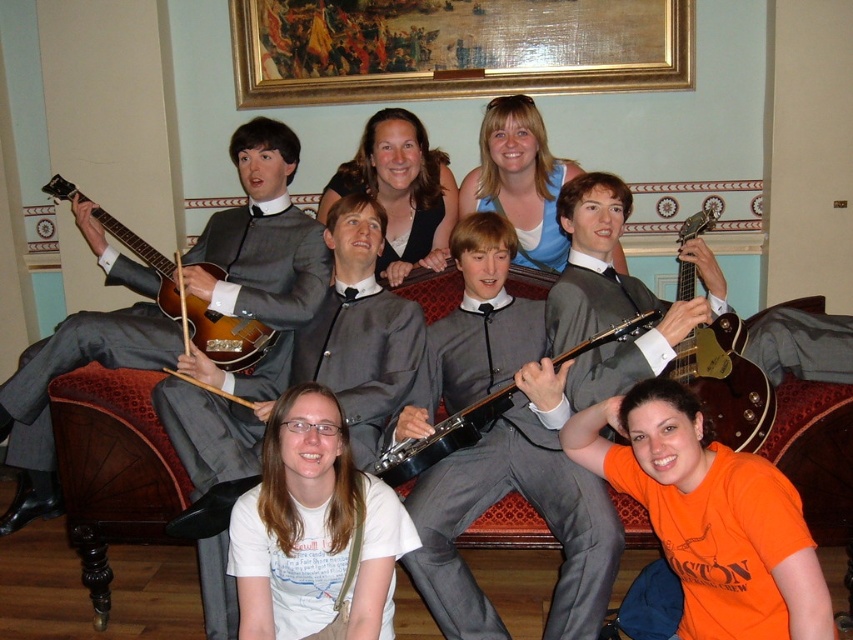
Looking at the two guitars in the image, the glossy wood guitar at upper right and the brushed metal guitar at left, which one is positioned to the right of the other?

The glossy wood guitar at upper right is positioned to the right of the brushed metal guitar at left.

You are a photographer setting up for a group photo. You need to place a microphone stand between the glossy wood guitar at upper right and the brushed metal guitar at left. Considering their sizes, which guitar should the stand be closer to?

The glossy wood guitar at upper right is smaller than the brushed metal guitar at left, so the microphone stand should be placed closer to the glossy wood guitar at upper right to ensure adequate space between them.

You are standing in the room where the group is posing. There is a shiny silver guitar at left and a point marked at coordinate (260,237). Can you tell me where exactly the point is located?

The point at (260,237) is on the shiny silver guitar at left.